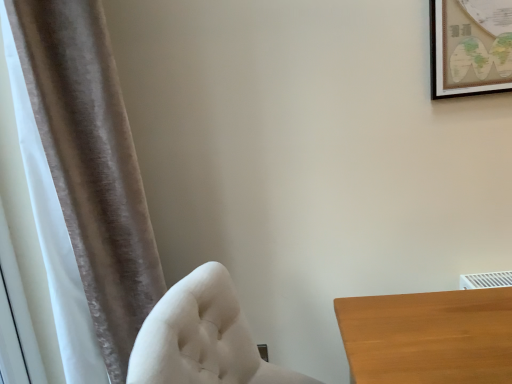
This screenshot has height=384, width=512. What do you see at coordinates (91, 165) in the screenshot?
I see `brown velvet curtain at left` at bounding box center [91, 165].

What is the approximate width of brown velvet curtain at left?

The width of brown velvet curtain at left is 12.93 inches.

Find the location of a particular element. Image resolution: width=512 pixels, height=384 pixels. brown velvet curtain at left is located at coordinates [91, 165].

What are the coordinates of `brown velvet curtain at left` in the screenshot? It's located at (91, 165).